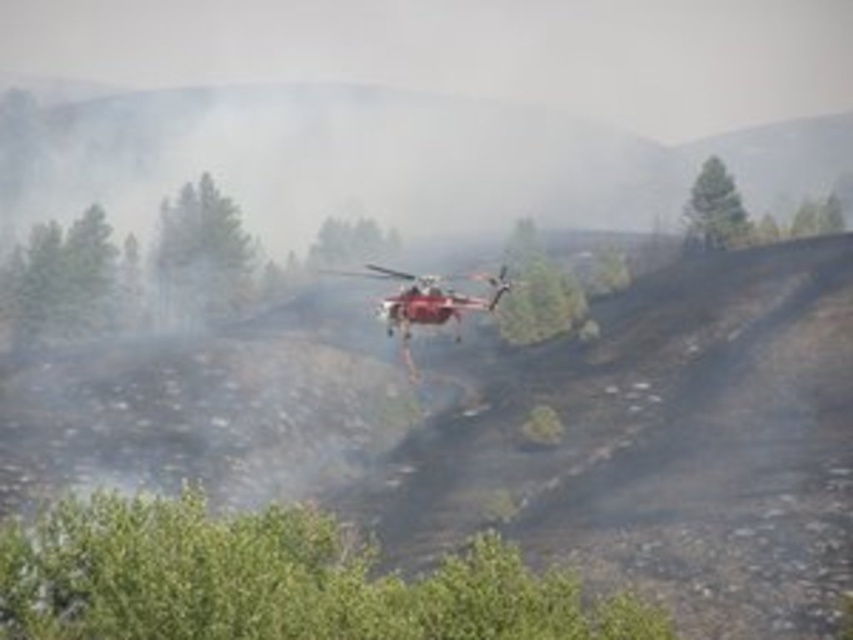
Question: Which object is the farthest from the green leafy tree at lower center?

Choices:
 (A) green matte tree at center
 (B) green matte tree at upper left
 (C) metallic red helicopter at center
 (D) green textured tree at upper right

Answer: (A)

Question: Does green matte tree at upper left appear under green textured tree at upper right?

Choices:
 (A) no
 (B) yes

Answer: (B)

Question: Does green textured tree at upper right appear on the right side of green matte tree at center?

Choices:
 (A) yes
 (B) no

Answer: (A)

Question: Is green leafy tree at lower center to the left of green matte tree at upper left from the viewer's perspective?

Choices:
 (A) yes
 (B) no

Answer: (B)

Question: Which point is farther to the camera?

Choices:
 (A) (216, 250)
 (B) (573, 627)
 (C) (355, 252)
 (D) (723, 211)

Answer: (C)

Question: Among these objects, which one is farthest from the camera?

Choices:
 (A) green leafy tree at lower center
 (B) green matte tree at center

Answer: (B)